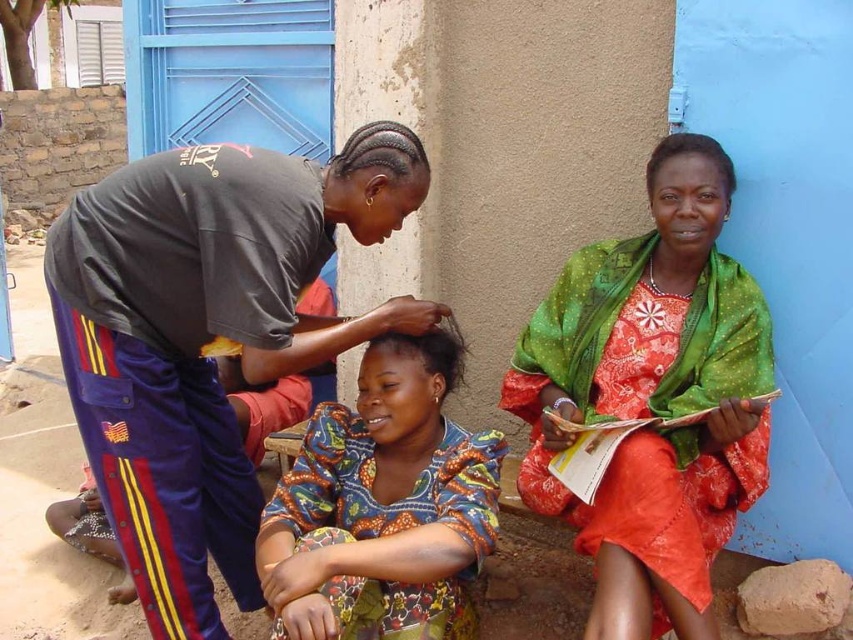
You are a photographer trying to capture a photo of the matte gray shirt at left and the printed fabric dress at center. The camera can only focus on objects wider than 30 cm. Which object is more likely to be in focus?

The matte gray shirt at left is wider than the printed fabric dress at center. Since the camera focuses on objects wider than 30 cm, the matte gray shirt at left is more likely to be in focus if it meets the width requirement.